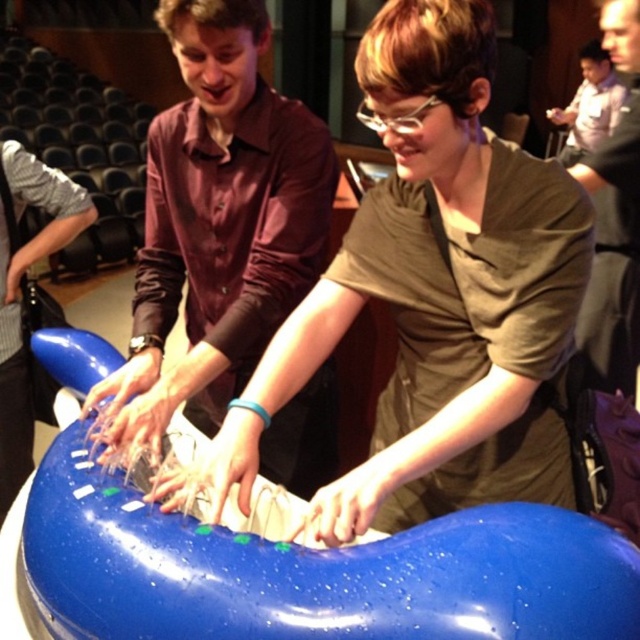
You are observing two people interacting with an inflatable sculpture. The person in the matte brown shirt at center is shorter than the person in the matte black shirt at upper right. Which person is shorter?

The matte brown shirt at center is shorter than the matte black shirt at upper right.